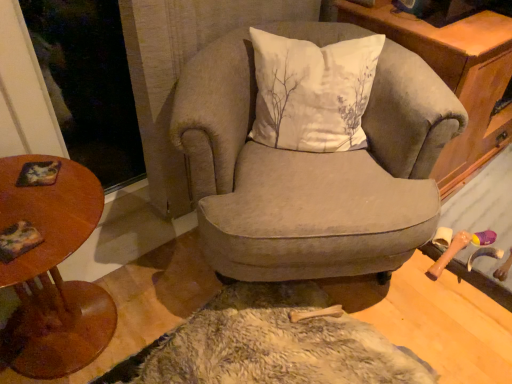
Question: Does point coord(113,332) appear closer or farther from the camera than point coord(279,248)?

Choices:
 (A) farther
 (B) closer

Answer: (A)

Question: Visually, is wooden round table at left positioned to the left or to the right of velvet gray armchair at center?

Choices:
 (A) left
 (B) right

Answer: (A)

Question: Estimate the real-world distances between objects in this image. Which object is closer to the wooden round table at left?

Choices:
 (A) wooden cabinet at upper right
 (B) velvet gray armchair at center
 (C) white cotton cushion at center

Answer: (B)

Question: Estimate the real-world distances between objects in this image. Which object is farther from the white cotton cushion at center?

Choices:
 (A) wooden round table at left
 (B) velvet gray armchair at center
 (C) wooden cabinet at upper right

Answer: (A)